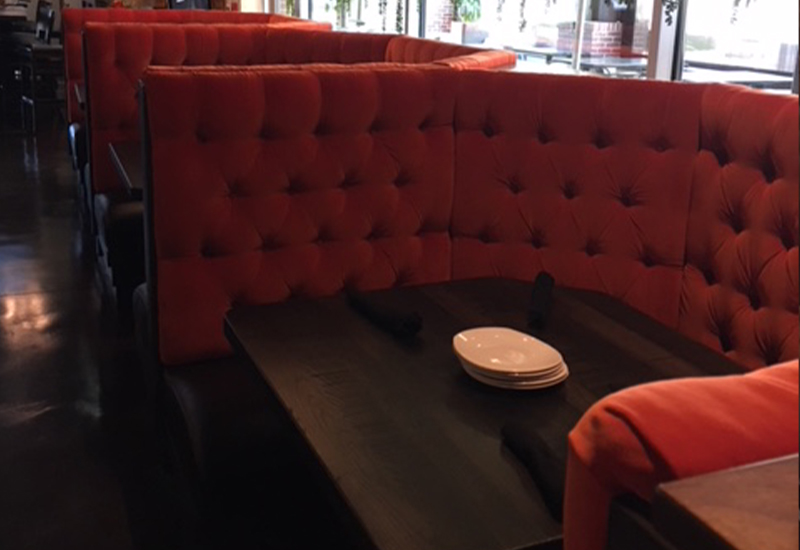
I want to click on partial plant, so click(669, 7).